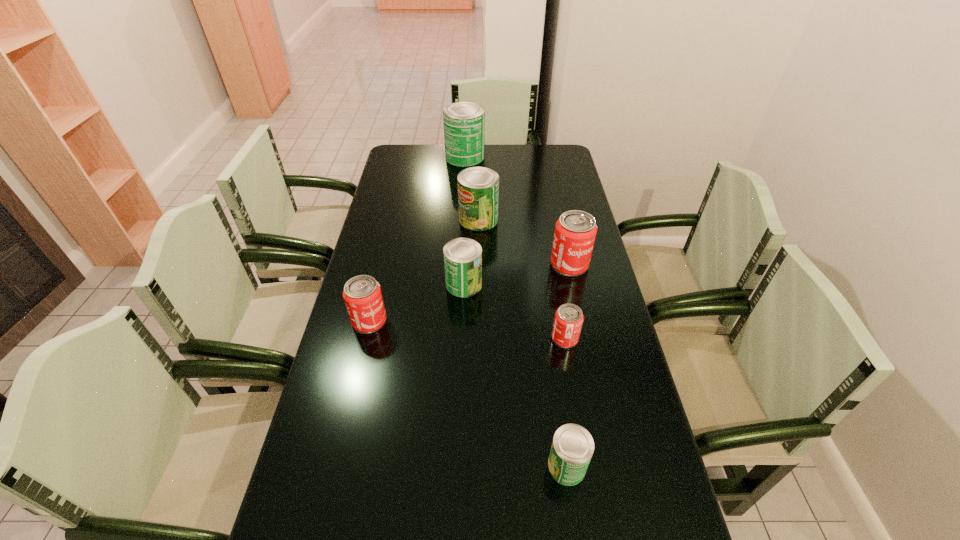
What are the coordinates of `vacant space that is in between the second smallest green can and the farthest red can` in the screenshot? It's located at (516, 274).

Point out which object is positioned as the third nearest to the second smallest green can. Please provide its 2D coordinates. Your answer should be formatted as a tuple, i.e. [(x, y)], where the tuple contains the x and y coordinates of a point satisfying the conditions above.

[(575, 231)]

Locate an element on the screen. the fifth closest object relative to the second nearest green can is located at coordinates (572, 448).

Select which can appears as the fifth closest to the third farthest green can. Please provide its 2D coordinates. Your answer should be formatted as a tuple, i.e. [(x, y)], where the tuple contains the x and y coordinates of a point satisfying the conditions above.

[(572, 448)]

Select which can is the closest to the biggest red can. Please provide its 2D coordinates. Your answer should be formatted as a tuple, i.e. [(x, y)], where the tuple contains the x and y coordinates of a point satisfying the conditions above.

[(478, 187)]

You are a GUI agent. You are given a task and a screenshot of the screen. Output one action in this format:
    pyautogui.click(x=<x>, y=<y>)
    Task: Click on the green can that can be found as the closest to the leftmost red can
    The image size is (960, 540).
    Given the screenshot: What is the action you would take?
    pyautogui.click(x=462, y=256)

Identify which green can is the third nearest to the farthest red can. Please provide its 2D coordinates. Your answer should be formatted as a tuple, i.e. [(x, y)], where the tuple contains the x and y coordinates of a point satisfying the conditions above.

[(572, 448)]

Identify which red can is located as the second nearest to the biggest red can. Please provide its 2D coordinates. Your answer should be formatted as a tuple, i.e. [(x, y)], where the tuple contains the x and y coordinates of a point satisfying the conditions above.

[(362, 294)]

Identify which red can is the third closest to the third farthest green can. Please provide its 2D coordinates. Your answer should be formatted as a tuple, i.e. [(x, y)], where the tuple contains the x and y coordinates of a point satisfying the conditions above.

[(568, 321)]

Identify the location of blank space that satisfies the following two spatial constraints: 1. on the back side of the leftmost red can; 2. on the right side of the second smallest green can. This screenshot has height=540, width=960. (378, 285).